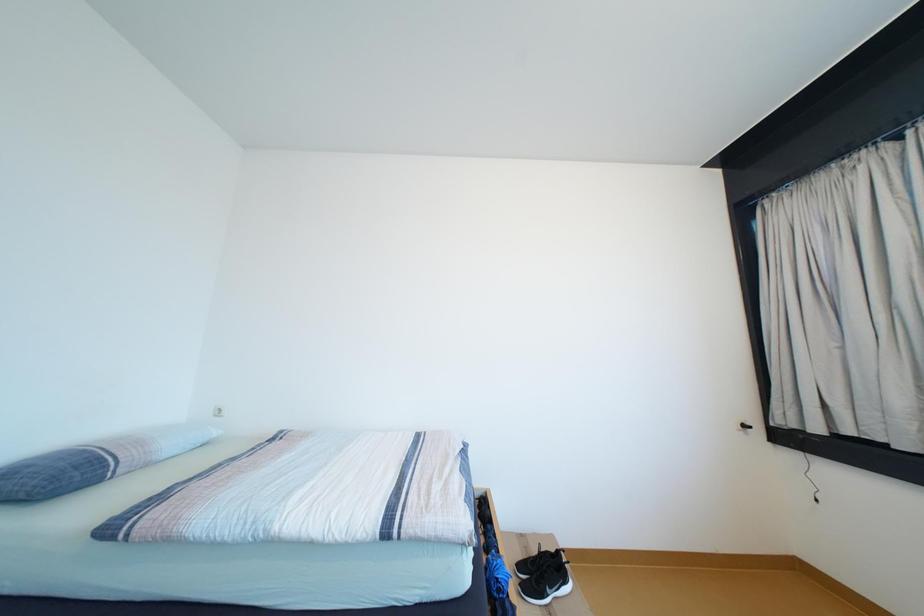
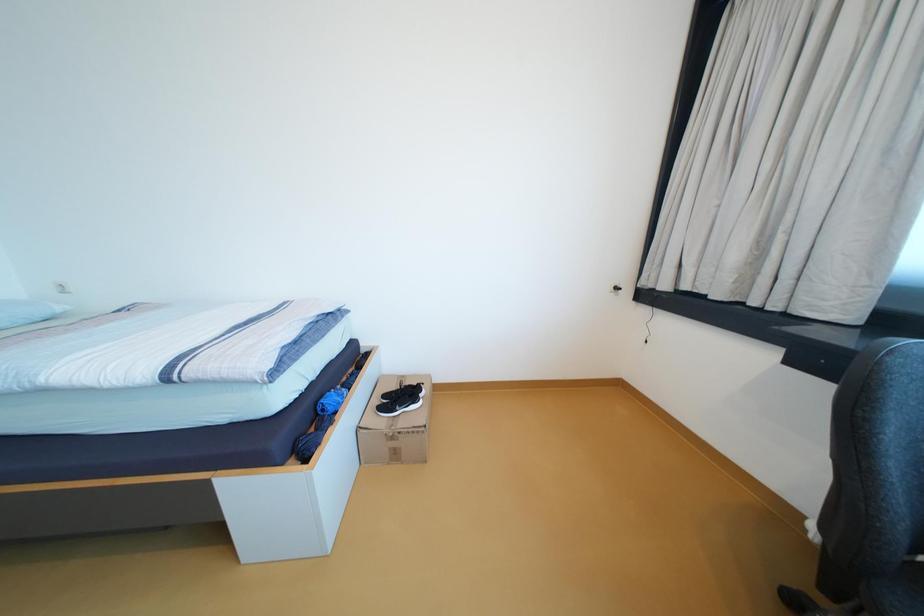
Question: What movement of the cameraman would produce the second image?

Choices:
 (A) Left
 (B) Right
 (C) Forward
 (D) Backward

Answer: (B)